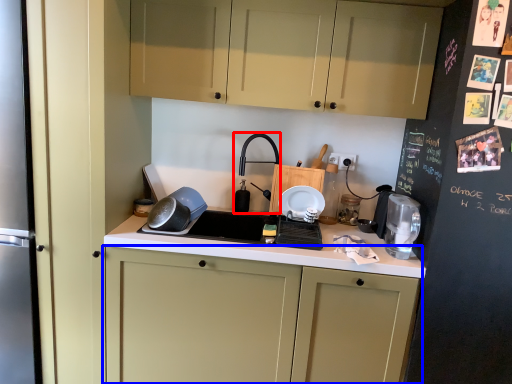
Question: Which object is further to the camera taking this photo, faucet (highlighted by a red box) or cabinetry (highlighted by a blue box)?

Choices:
 (A) faucet
 (B) cabinetry

Answer: (A)